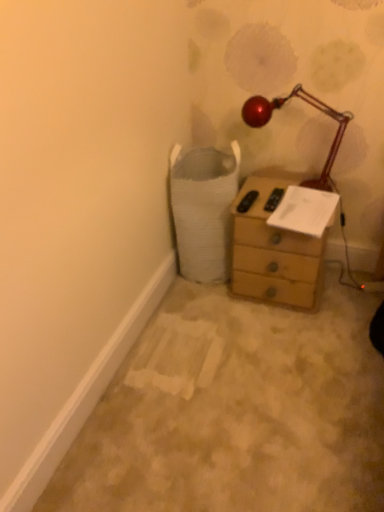
Identify the location of vacant space in metallic red lamp at upper right (from a real-world perspective). This screenshot has height=512, width=384. (276, 187).